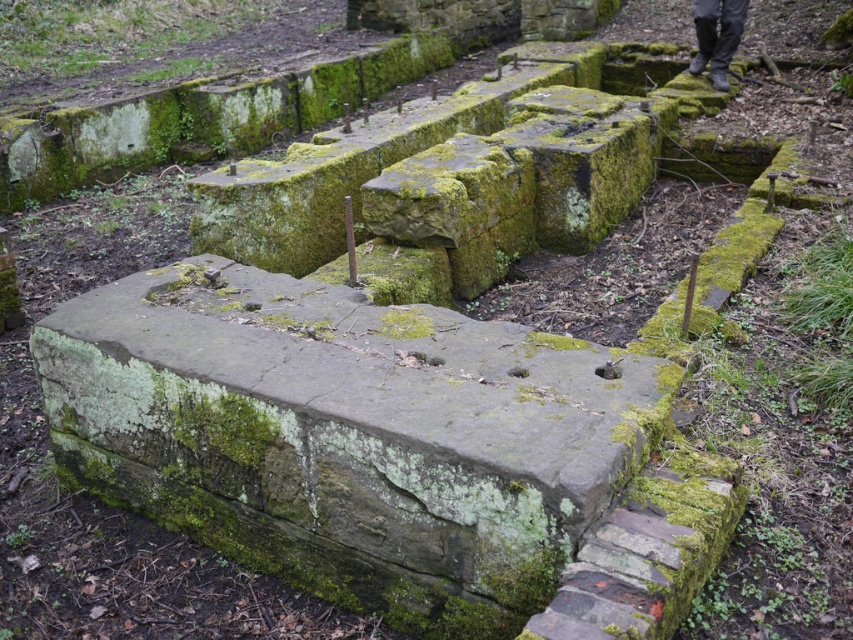
Does green mossy stone at center have a larger size compared to dark gray pants at upper right?

Yes.

Between green mossy stone at center and dark gray pants at upper right, which one appears on the left side from the viewer's perspective?

green mossy stone at center

Locate an element on the screen. green mossy stone at center is located at coordinates (347, 435).